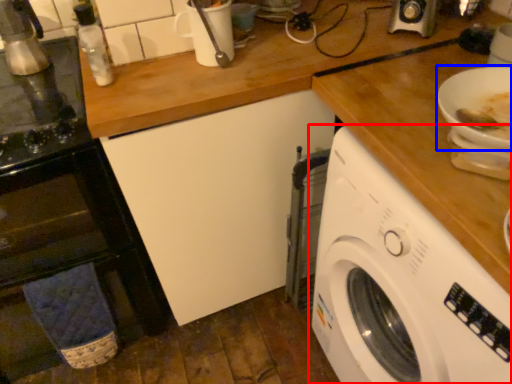
Question: Among these objects, which one is farthest to the camera, washing machine (highlighted by a red box) or bowl (highlighted by a blue box)?

Choices:
 (A) washing machine
 (B) bowl

Answer: (B)